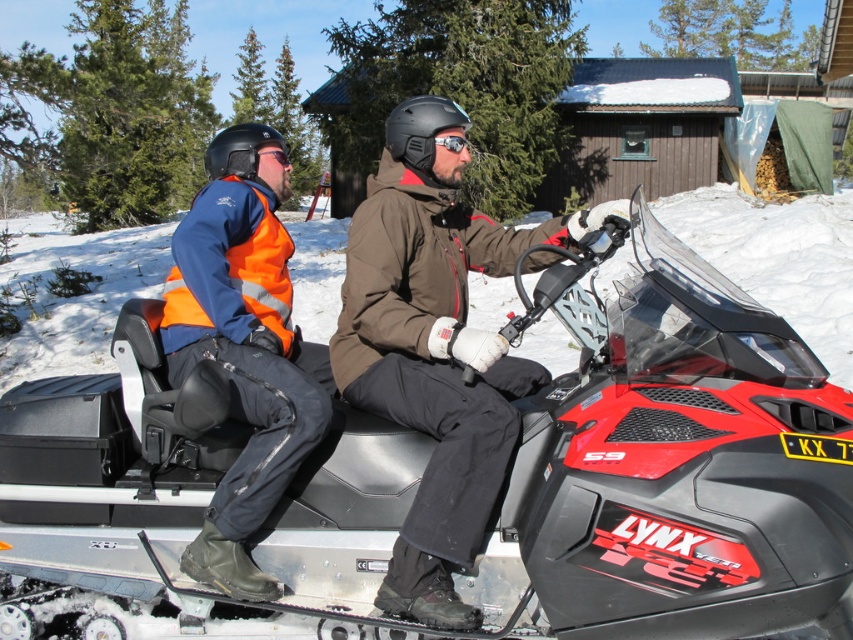
You are a delivery drone with a 1.2 meter wingspan. You need to fly between the red plastic snowmobile at center and the transparent plastic goggles at center. Can you fit through the space between them?

The distance between the red plastic snowmobile at center and transparent plastic goggles at center is 1.53 meters. Since the drone has a 1.2 meter wingspan, it can fit through the space as the distance is wider than the drone.

You are a snowmobile rider wearing both the transparent plastic goggles at center and the matte black goggles at upper center. Which pair of goggles is positioned higher on your face?

The matte black goggles at upper center are positioned higher on your face than the transparent plastic goggles at center.